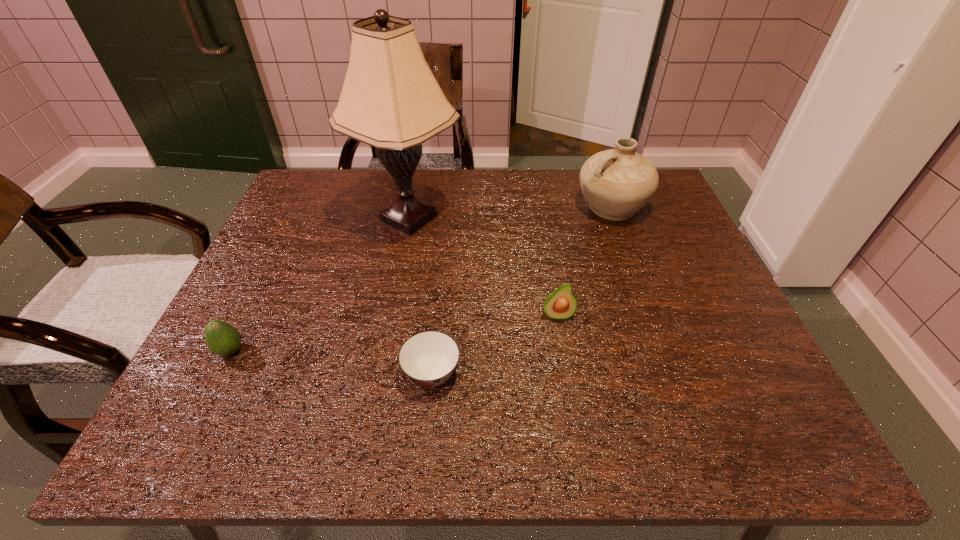
Identify the location of vacant space located 0.250m on the cut side of the farther avocado. The image size is (960, 540). (577, 432).

The width and height of the screenshot is (960, 540). What are the coordinates of `free space located 0.180m on the right of the fourth tallest object` in the screenshot? It's located at (333, 351).

Where is `free space located on the right of the soup bowl`? The image size is (960, 540). free space located on the right of the soup bowl is located at coordinates (567, 374).

Identify the location of lamp that is at the far edge. pyautogui.click(x=390, y=99).

Find the location of a particular element. This screenshot has height=540, width=960. pottery at the far edge is located at coordinates (616, 183).

The height and width of the screenshot is (540, 960). In order to click on object positioned at the left edge in this screenshot , I will do [223, 339].

Locate an element on the screen. object present at the right edge is located at coordinates (x=616, y=183).

Find the location of a particular element. The width and height of the screenshot is (960, 540). object at the far right corner is located at coordinates (616, 183).

In the image, there is a desktop. Identify the location of vacant space at the far edge. This screenshot has width=960, height=540. (538, 183).

Identify the location of blank area at the left edge. (292, 258).